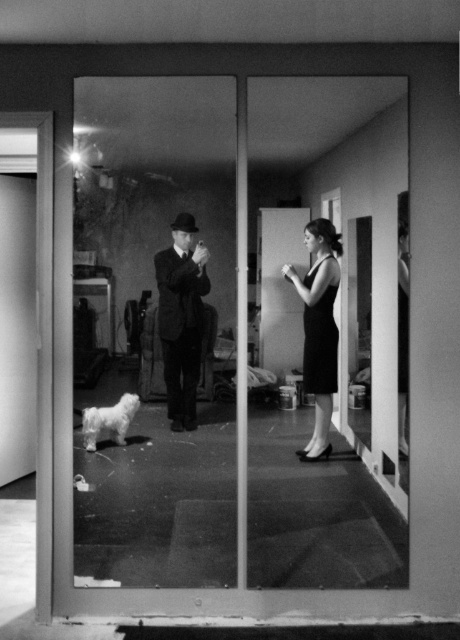
You are a photographer trying to capture the reflection in the glass door. You notice the smooth black suit at center and the white fluffy dog at lower left. Which object in the reflection is closer to the glass door?

The smooth black suit at center is positioned over the white fluffy dog at lower left in the reflection, meaning it is closer to the glass door.

From the picture: Based on the scene described, which object in the image is shorter between the smooth black suit at center and the black satin dress at center?

The smooth black suit at center is shorter than the black satin dress at center.